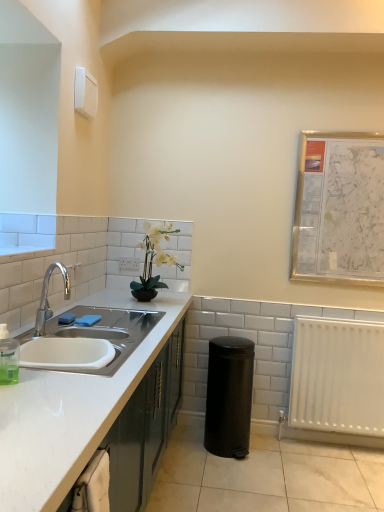
Locate an element on the screen. free location in front of blue sponge at sink left is located at coordinates (72, 333).